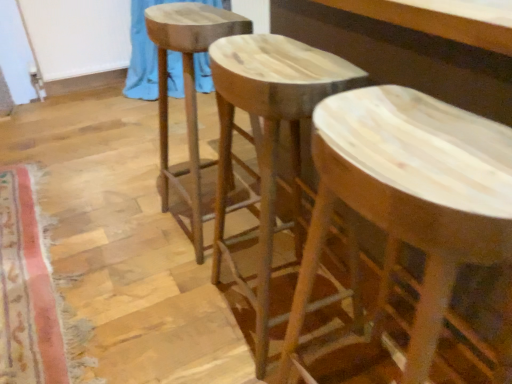
Find the location of a particular element. This screenshot has width=512, height=384. free space in front of natural wood stool at center, which is the 1th stool in left-to-right order is located at coordinates (168, 291).